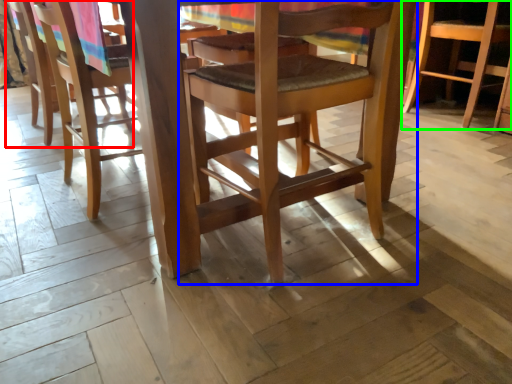
Question: Which is nearer to the chair (highlighted by a red box)? chair (highlighted by a blue box) or chair (highlighted by a green box).

Choices:
 (A) chair
 (B) chair

Answer: (A)